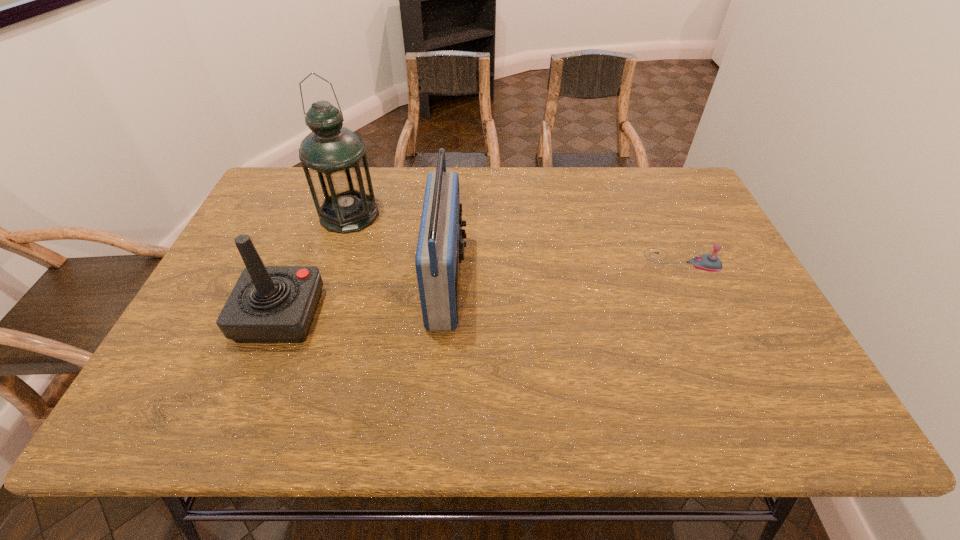
Locate which object is the third closest to the shortest object. Please provide its 2D coordinates. Your answer should be formatted as a tuple, i.e. [(x, y)], where the tuple contains the x and y coordinates of a point satisfying the conditions above.

[(269, 304)]

At what (x,y) coordinates should I click in order to perform the action: click on object that ranks as the closest to the third tallest object. Please return your answer as a coordinate pair (x, y). The image size is (960, 540). Looking at the image, I should click on (333, 157).

The width and height of the screenshot is (960, 540). I want to click on free location that satisfies the following two spatial constraints: 1. on the front side of the right joystick; 2. on the front panel of the radio receiver, so click(x=691, y=282).